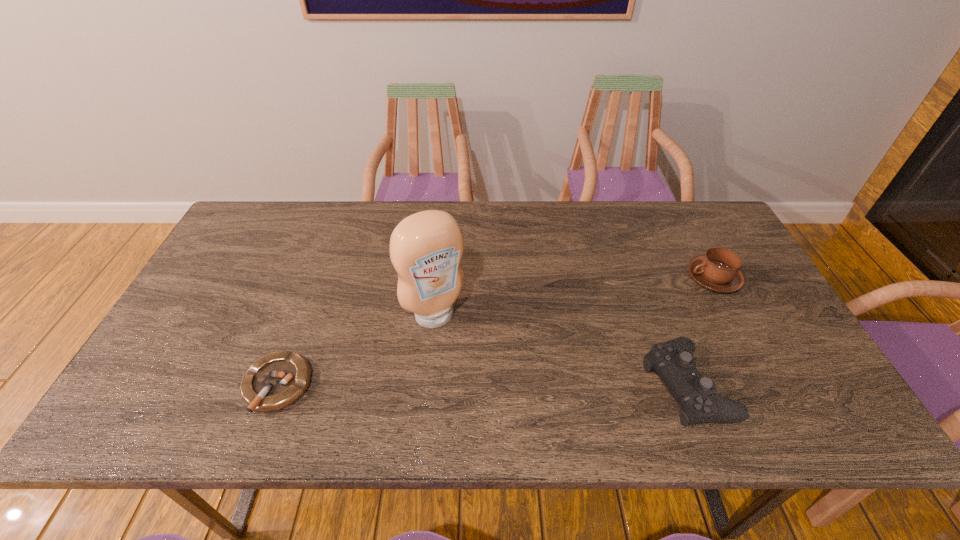
Find the location of `vacant space on the desktop that is between the leftmost object and the third object from left to right and is positioned on the side of the cappuccino with the handle`. vacant space on the desktop that is between the leftmost object and the third object from left to right and is positioned on the side of the cappuccino with the handle is located at coordinates (525, 385).

The width and height of the screenshot is (960, 540). I want to click on free space on the desktop that is between the ashtray and the control and is positioned on the label of the second object from left to right, so click(x=477, y=385).